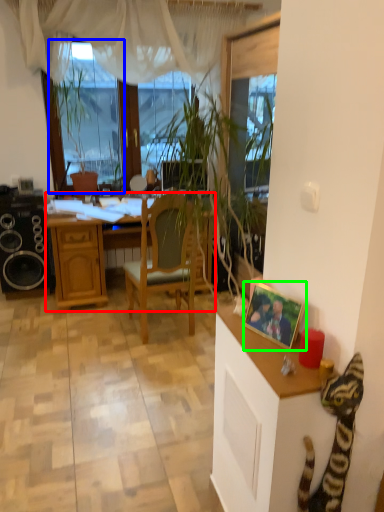
Question: Which object is the farthest from desk (highlighted by a red box)? Choose among these: window screen (highlighted by a blue box) or picture frame (highlighted by a green box).

Choices:
 (A) window screen
 (B) picture frame

Answer: (B)